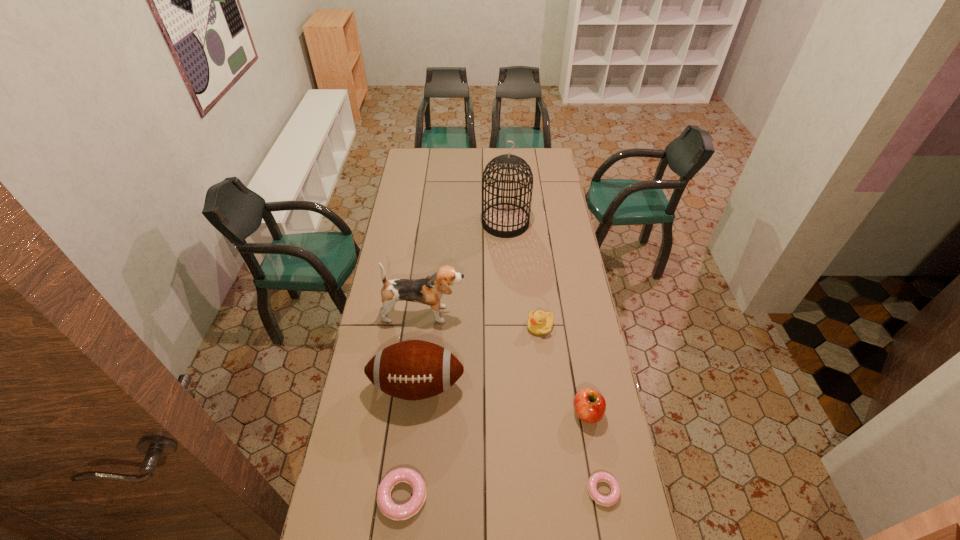
Please point a location where one more doughnut can be added evenly. Please provide its 2D coordinates. Your answer should be formatted as a tuple, i.e. [(x, y)], where the tuple contains the x and y coordinates of a point satisfying the conditions above.

[(503, 493)]